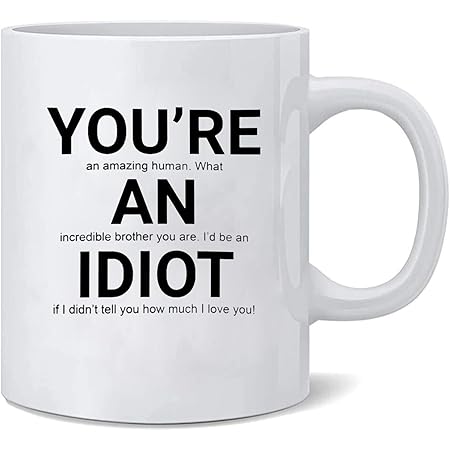
This screenshot has height=450, width=450. In order to click on white mug in this screenshot , I will do `click(206, 354)`.